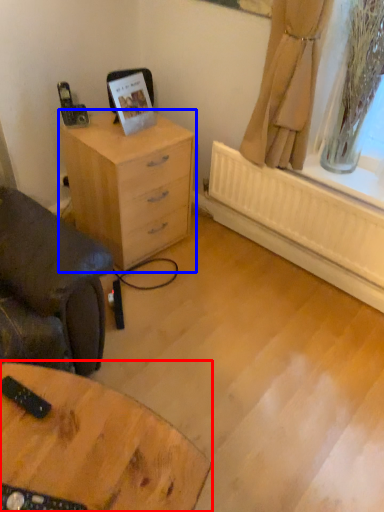
Question: Which of the following is the closest to the observer, table (highlighted by a red box) or chest of drawers (highlighted by a blue box)?

Choices:
 (A) table
 (B) chest of drawers

Answer: (A)